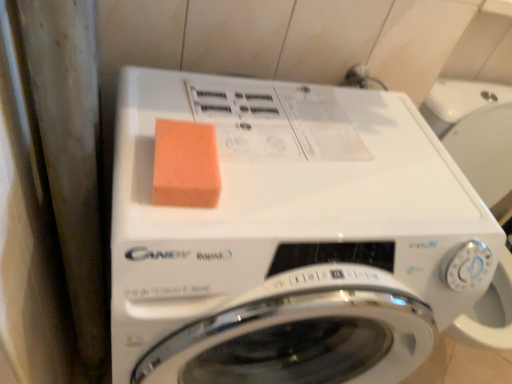
What do you see at coordinates (295, 238) in the screenshot? The height and width of the screenshot is (384, 512). I see `white glossy washing machine at center` at bounding box center [295, 238].

At what (x,y) coordinates should I click in order to perform the action: click on white glossy washing machine at center. Please return your answer as a coordinate pair (x, y). The height and width of the screenshot is (384, 512). Looking at the image, I should click on (295, 238).

At what (x,y) coordinates should I click in order to perform the action: click on orange sponge at upper center. Please return your answer as a coordinate pair (x, y). This screenshot has height=384, width=512. Looking at the image, I should click on point(185,165).

Describe the element at coordinates (185, 165) in the screenshot. I see `orange sponge at upper center` at that location.

The height and width of the screenshot is (384, 512). I want to click on white glossy washing machine at center, so click(295, 238).

Which is more to the right, white glossy washing machine at center or orange sponge at upper center?

Positioned to the right is white glossy washing machine at center.

Considering the positions of objects white glossy washing machine at center and orange sponge at upper center in the image provided, who is behind, white glossy washing machine at center or orange sponge at upper center?

orange sponge at upper center is further away from the camera.

Considering the positions of points (271, 277) and (169, 178), is point (271, 277) farther from camera compared to point (169, 178)?

Yes, point (271, 277) is behind point (169, 178).

From the image's perspective, which one is positioned higher, white glossy washing machine at center or orange sponge at upper center?

orange sponge at upper center appears higher in the image.

From a real-world perspective, is white glossy washing machine at center positioned under orange sponge at upper center based on gravity?

Yes, from a real-world perspective, white glossy washing machine at center is below orange sponge at upper center.

Can you confirm if white glossy washing machine at center is wider than orange sponge at upper center?

Yes, white glossy washing machine at center is wider than orange sponge at upper center.

Who is taller, white glossy washing machine at center or orange sponge at upper center?

With more height is white glossy washing machine at center.

Consider the image. Between white glossy washing machine at center and orange sponge at upper center, which one has larger size?

white glossy washing machine at center.

Is orange sponge at upper center located within white glossy washing machine at center?

Indeed, orange sponge at upper center is located within white glossy washing machine at center.

Is white glossy washing machine at center placed right next to orange sponge at upper center?

They are not placed beside each other.

Is white glossy washing machine at center facing away from orange sponge at upper center?

white glossy washing machine at center does not have its back to orange sponge at upper center.

How different are the orientations of white glossy washing machine at center and orange sponge at upper center in degrees?

4.29 degrees separate the facing orientations of white glossy washing machine at center and orange sponge at upper center.

Where is `food that appears on the left of white glossy washing machine at center`? food that appears on the left of white glossy washing machine at center is located at coordinates (185, 165).

Which object is positioned more to the left, orange sponge at upper center or white glossy washing machine at center?

orange sponge at upper center is more to the left.

Considering their positions, is orange sponge at upper center located in front of or behind white glossy washing machine at center?

orange sponge at upper center is positioned farther from the viewer than white glossy washing machine at center.

Does point (164, 121) lie in front of point (142, 193)?

That is False.

From the image's perspective, does orange sponge at upper center appear higher than white glossy washing machine at center?

Yes.

From a real-world perspective, who is located lower, orange sponge at upper center or white glossy washing machine at center?

From a 3D spatial view, white glossy washing machine at center is below.

Which object is thinner, orange sponge at upper center or white glossy washing machine at center?

orange sponge at upper center.

Does orange sponge at upper center have a greater height compared to white glossy washing machine at center?

No.

Can you confirm if orange sponge at upper center is smaller than white glossy washing machine at center?

Indeed, orange sponge at upper center has a smaller size compared to white glossy washing machine at center.

Could white glossy washing machine at center be considered to be inside orange sponge at upper center?

Definitely not — white glossy washing machine at center is not inside orange sponge at upper center.

Is orange sponge at upper center positioned far away from white glossy washing machine at center?

orange sponge at upper center is near white glossy washing machine at center, not far away.

Is orange sponge at upper center turned away from white glossy washing machine at center?

orange sponge at upper center is not turned away from white glossy washing machine at center.

What's the angular difference between orange sponge at upper center and white glossy washing machine at center's facing directions?

The angle between the facing direction of orange sponge at upper center and the facing direction of white glossy washing machine at center is 4.29 degrees.

Locate an element on the screen. This screenshot has width=512, height=384. washing machine below the orange sponge at upper center (from a real-world perspective) is located at coordinates (295, 238).

Where is `washing machine that is in front of the orange sponge at upper center`? This screenshot has height=384, width=512. washing machine that is in front of the orange sponge at upper center is located at coordinates (295, 238).

Where is `food located above the white glossy washing machine at center (from a real-world perspective)`? The image size is (512, 384). food located above the white glossy washing machine at center (from a real-world perspective) is located at coordinates tap(185, 165).